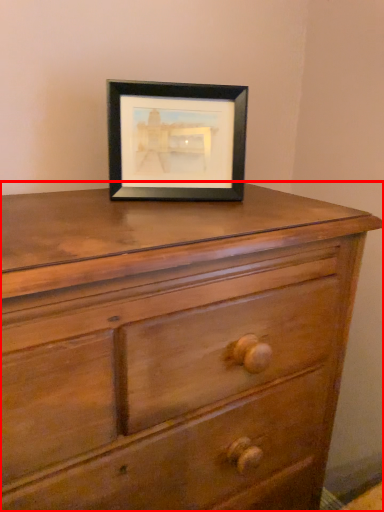
Question: In this image, where is chest of drawers (annotated by the red box) located relative to picture frame?

Choices:
 (A) right
 (B) left

Answer: (B)